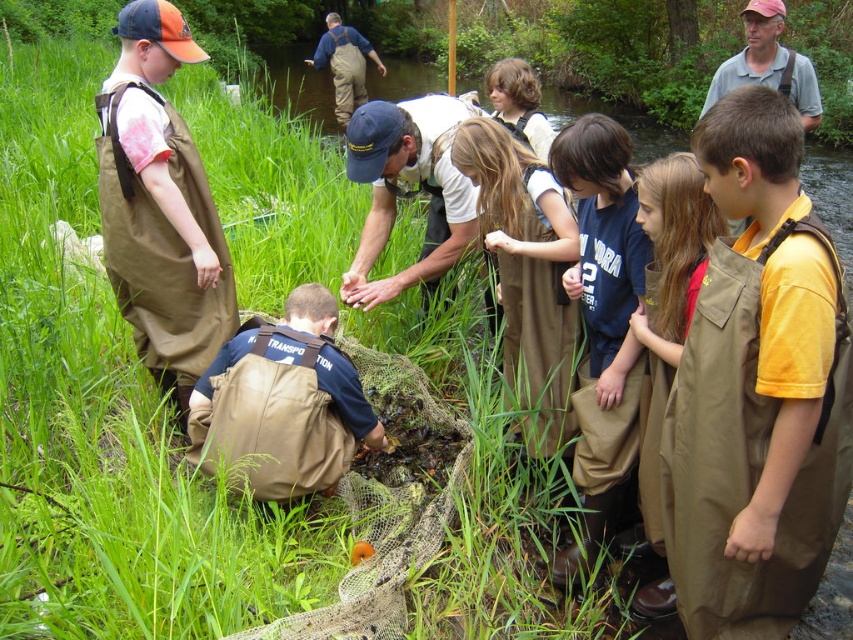
You are a participant in this outdoor activity and need to access the contents of the brown waterproof apron at center. Can you easily reach it while the brown canvas apron at center is in front of it?

The brown canvas apron at center is in front of the brown waterproof apron at center, so you cannot easily reach the brown waterproof apron at center without moving the brown canvas apron at center first.